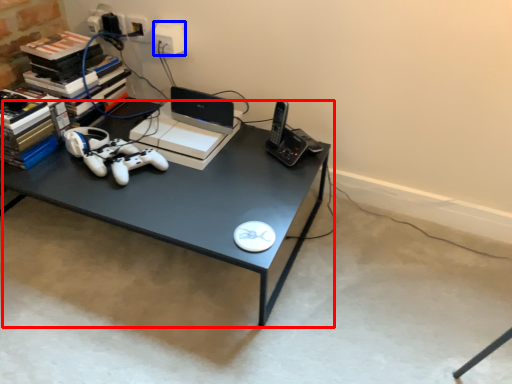
Question: Which object appears closest to the camera in this image, desk (highlighted by a red box) or electric outlet (highlighted by a blue box)?

Choices:
 (A) desk
 (B) electric outlet

Answer: (A)